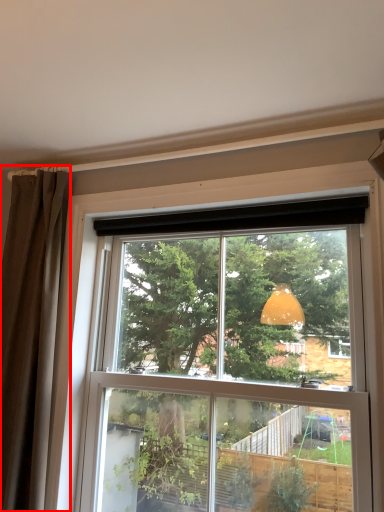
Question: From the image's perspective, where is curtain (annotated by the red box) located relative to window?

Choices:
 (A) below
 (B) above

Answer: (B)